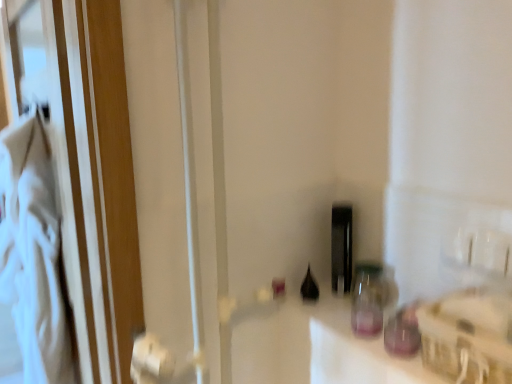
Question: Does point (366, 281) appear closer or farther from the camera than point (408, 306)?

Choices:
 (A) farther
 (B) closer

Answer: (A)

Question: Is transparent glass jar at center-right, acting as the third bottle starting from the back, inside the boundaries of transparent glass bottle at center, which is the 4th bottle from back to front, or outside?

Choices:
 (A) outside
 (B) inside

Answer: (A)

Question: Estimate the real-world distances between objects in this image. Which object is closer to the black glass bottle at center, which ranks as the first bottle in back-to-front order?

Choices:
 (A) black glass bottle at center, the 3th bottle from the front
 (B) transparent glass bottle at center, the first bottle from the front
 (C) transparent glass jar at center-right, which is counted as the second bottle, starting from the front
 (D) white glossy counter top at center

Answer: (C)

Question: Which of these objects is positioned farthest from the transparent glass bottle at center, which is the 4th bottle from back to front?

Choices:
 (A) black glass bottle at center, which is the 4th bottle in front-to-back order
 (B) white glossy counter top at center
 (C) transparent glass jar at center-right, acting as the third bottle starting from the back
 (D) black glass bottle at center, the 3th bottle from the front

Answer: (D)